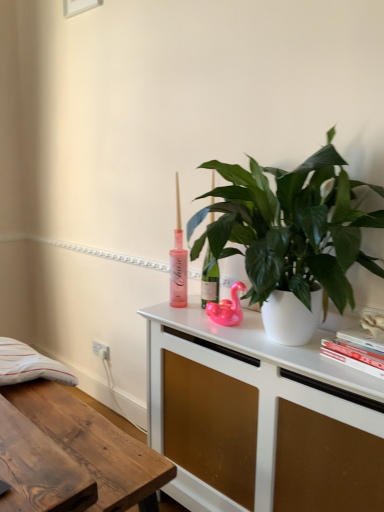
Question: Does white plastic electric outlet at lower left have a smaller size compared to wooden desk at lower left?

Choices:
 (A) no
 (B) yes

Answer: (B)

Question: Does white plastic electric outlet at lower left lie behind wooden desk at lower left?

Choices:
 (A) yes
 (B) no

Answer: (A)

Question: Is white plastic electric outlet at lower left facing towards wooden desk at lower left?

Choices:
 (A) yes
 (B) no

Answer: (A)

Question: From the image's perspective, does white plastic electric outlet at lower left appear lower than wooden desk at lower left?

Choices:
 (A) no
 (B) yes

Answer: (A)

Question: From a real-world perspective, is white plastic electric outlet at lower left on top of wooden desk at lower left?

Choices:
 (A) yes
 (B) no

Answer: (A)

Question: Based on their sizes in the image, would you say pink rubber duck at center is bigger or smaller than wooden desk at lower left?

Choices:
 (A) big
 (B) small

Answer: (B)

Question: Considering the positions of point (236, 316) and point (43, 423), is point (236, 316) closer or farther from the camera than point (43, 423)?

Choices:
 (A) farther
 (B) closer

Answer: (B)

Question: From a real-world perspective, is pink rubber duck at center above or below wooden desk at lower left?

Choices:
 (A) below
 (B) above

Answer: (B)

Question: Considering the positions of pink rubber duck at center and wooden desk at lower left in the image, is pink rubber duck at center taller or shorter than wooden desk at lower left?

Choices:
 (A) tall
 (B) short

Answer: (B)

Question: From the image's perspective, is wooden desk at lower left above or below white matte cabinet at center?

Choices:
 (A) above
 (B) below

Answer: (B)

Question: Is point (114, 440) closer or farther from the camera than point (339, 423)?

Choices:
 (A) closer
 (B) farther

Answer: (B)

Question: In the image, is wooden desk at lower left on the left side or the right side of white matte cabinet at center?

Choices:
 (A) right
 (B) left

Answer: (B)

Question: In the image, is wooden desk at lower left positioned in front of or behind white matte cabinet at center?

Choices:
 (A) behind
 (B) front

Answer: (A)

Question: Does point (258, 380) appear closer or farther from the camera than point (52, 406)?

Choices:
 (A) closer
 (B) farther

Answer: (A)

Question: Looking at the image, does white matte cabinet at center seem bigger or smaller compared to wooden desk at lower left?

Choices:
 (A) small
 (B) big

Answer: (B)